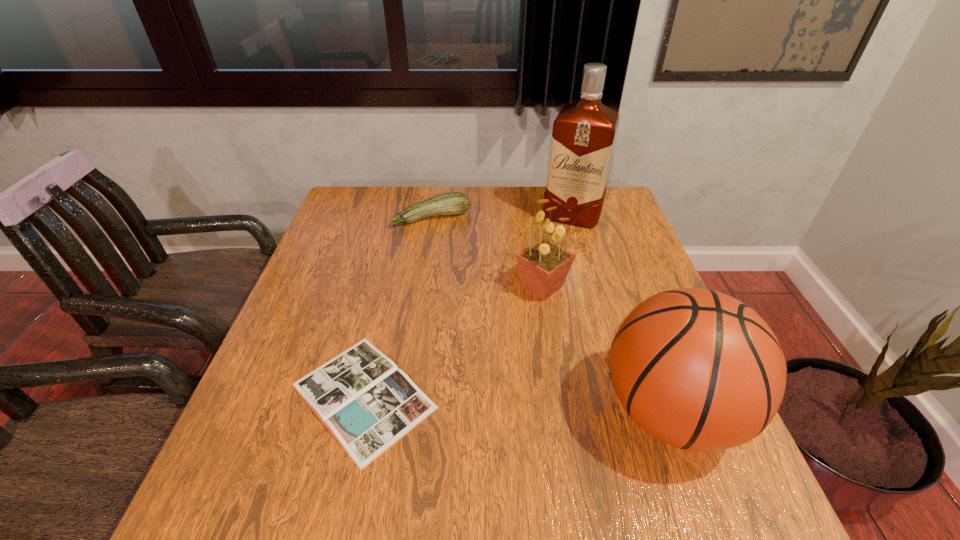
Where is `object that is at the left edge`? object that is at the left edge is located at coordinates (367, 403).

Image resolution: width=960 pixels, height=540 pixels. Find the location of `basketball located in the right edge section of the desktop`. basketball located in the right edge section of the desktop is located at coordinates (697, 369).

Where is `liquor that is at the right edge`? liquor that is at the right edge is located at coordinates [583, 137].

Locate an element on the screen. object positioned at the near left corner is located at coordinates (367, 403).

You are a GUI agent. You are given a task and a screenshot of the screen. Output one action in this format:
    pyautogui.click(x=<x>, y=<y>)
    Task: Click on the object situated at the far right corner
    The image size is (960, 540).
    Given the screenshot: What is the action you would take?
    coord(583,137)

In order to click on object positioned at the near right corner in this screenshot , I will do `click(697, 369)`.

In the image, there is a desktop. Identify the location of vacant space at the far edge. (491, 214).

In the image, there is a desktop. Where is `blank space at the near edge`? This screenshot has height=540, width=960. blank space at the near edge is located at coordinates (415, 463).

The width and height of the screenshot is (960, 540). In the image, there is a desktop. What are the coordinates of `vacant space at the left edge` in the screenshot? It's located at (347, 242).

This screenshot has width=960, height=540. I want to click on free spot at the right edge of the desktop, so click(x=617, y=286).